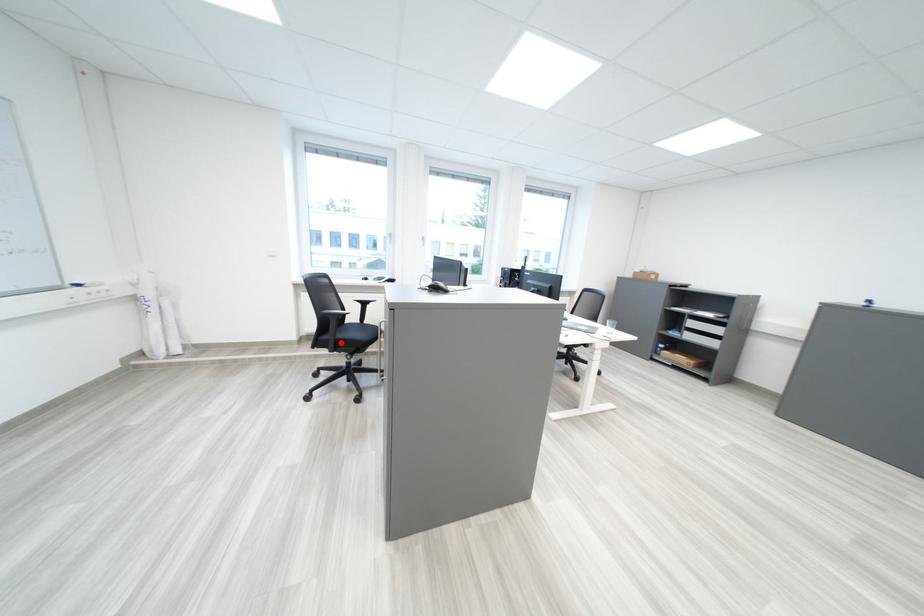
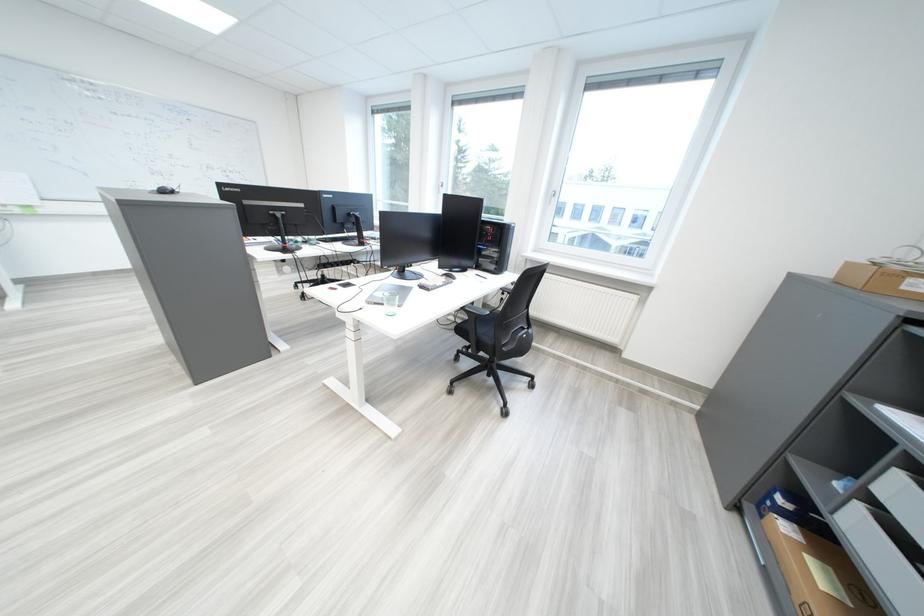
Question: I am providing you with two images of the same scene from different viewpoints. A red point is marked on the first image. At the location where the point appears in image 1, is it still visible in image 2?

Choices:
 (A) Yes
 (B) No

Answer: (B)